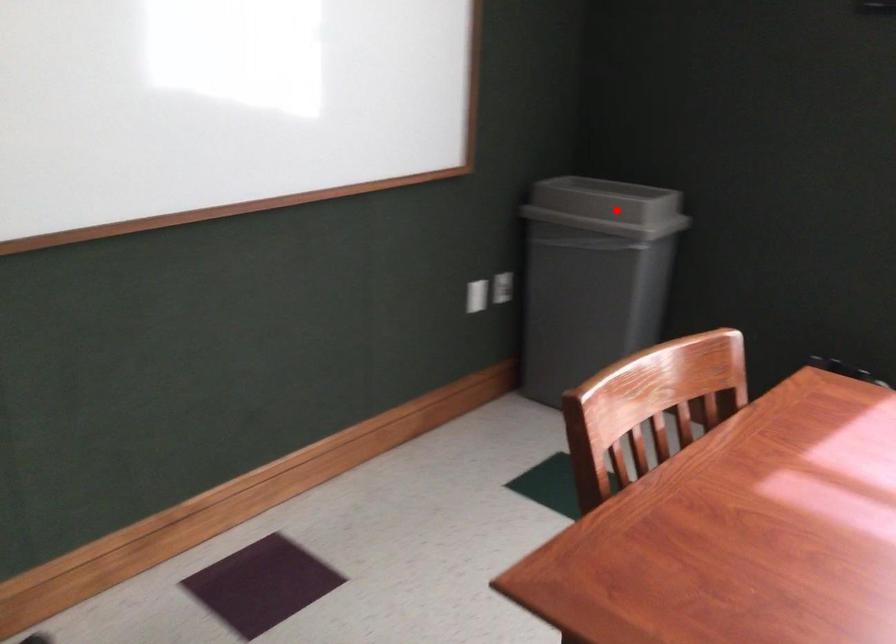
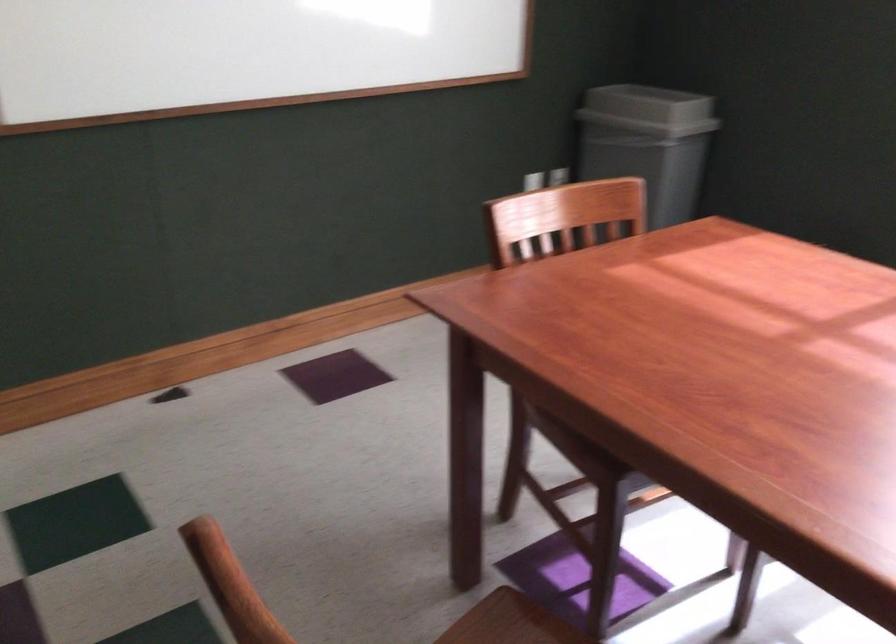
In the second image, find the point that corresponds to the highlighted location in the first image.

(648, 109)